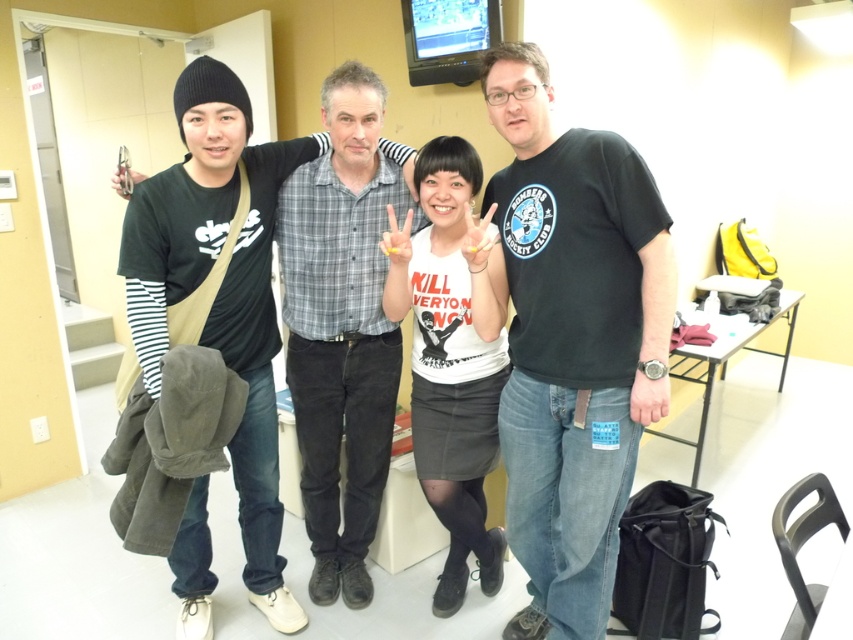
Question: Which of the following is the closest to the observer?

Choices:
 (A) (553, 634)
 (B) (253, 570)

Answer: (A)

Question: Which point is closer to the camera?

Choices:
 (A) (527, 208)
 (B) (206, 234)

Answer: (A)

Question: Does black cotton shirt at center appear on the right side of white matte shirt at center?

Choices:
 (A) no
 (B) yes

Answer: (A)

Question: Is black cotton t-shirt at center smaller than white matte shirt at center?

Choices:
 (A) no
 (B) yes

Answer: (B)

Question: Which of the following is the farthest from the observer?

Choices:
 (A) gray plaid shirt at center
 (B) black cotton t-shirt at center
 (C) white matte shirt at center

Answer: (A)

Question: Is the position of gray plaid shirt at center more distant than that of white matte shirt at center?

Choices:
 (A) no
 (B) yes

Answer: (B)